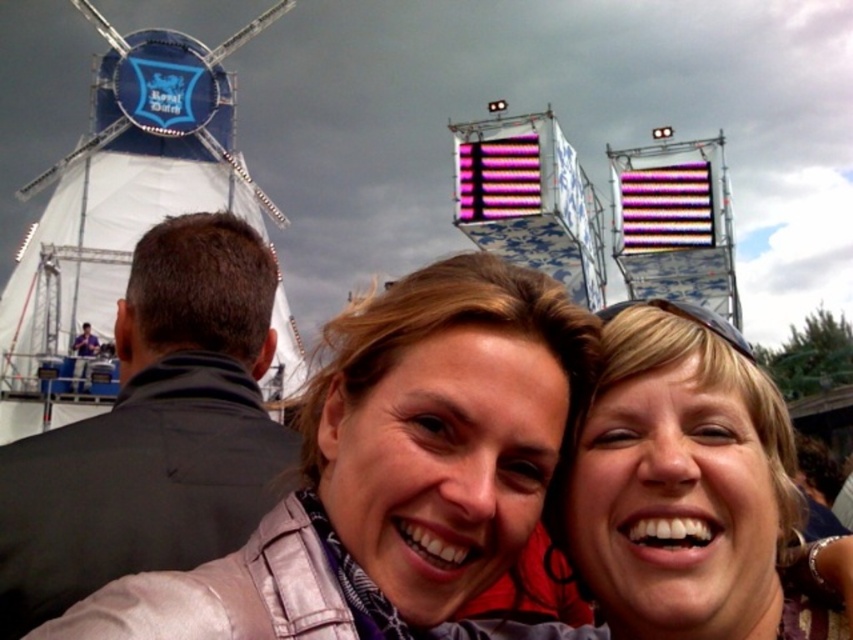
What do you see at coordinates (393, 468) in the screenshot?
I see `matte gray jacket at center` at bounding box center [393, 468].

Does matte gray jacket at center have a lesser height compared to black leather jacket at upper left?

Yes, matte gray jacket at center is shorter than black leather jacket at upper left.

Locate an element on the screen. This screenshot has height=640, width=853. matte gray jacket at center is located at coordinates (393, 468).

Find the location of a particular element. The image size is (853, 640). matte gray jacket at center is located at coordinates (393, 468).